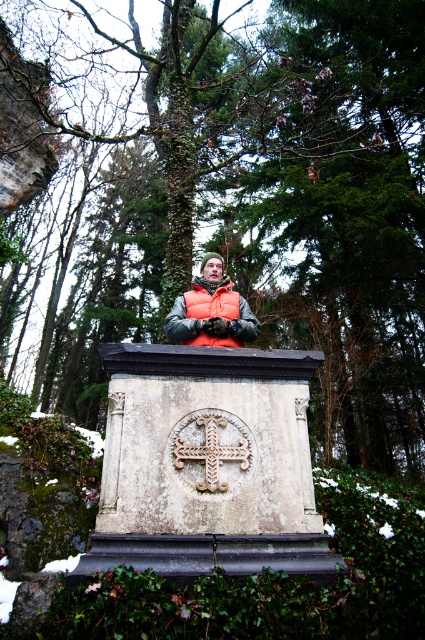
Who is positioned more to the left, rusty metal cross at center or orange fleece vest at center?

From the viewer's perspective, orange fleece vest at center appears more on the left side.

Does point (223, 456) come closer to viewer compared to point (246, 310)?

Yes, point (223, 456) is closer to viewer.

Which is behind, point (206, 467) or point (172, 326)?

The point (172, 326) is behind.

Where is `rusty metal cross at center`? This screenshot has width=425, height=640. rusty metal cross at center is located at coordinates (210, 452).

Is white stone monument at center positioned before orange fleece vest at center?

Yes, it is in front of orange fleece vest at center.

Is white stone monument at center bigger than orange fleece vest at center?

Correct, white stone monument at center is larger in size than orange fleece vest at center.

Does point (232, 493) come behind point (183, 330)?

No.

Identify the location of white stone monument at center. This screenshot has height=640, width=425. (207, 464).

Who is taller, green leafy tree at center or orange fleece vest at center?

Standing taller between the two is green leafy tree at center.

Does green leafy tree at center have a greater height compared to orange fleece vest at center?

Correct, green leafy tree at center is much taller as orange fleece vest at center.

The width and height of the screenshot is (425, 640). What are the coordinates of `green leafy tree at center` in the screenshot? It's located at (237, 204).

Identify the location of green leafy tree at center. (237, 204).